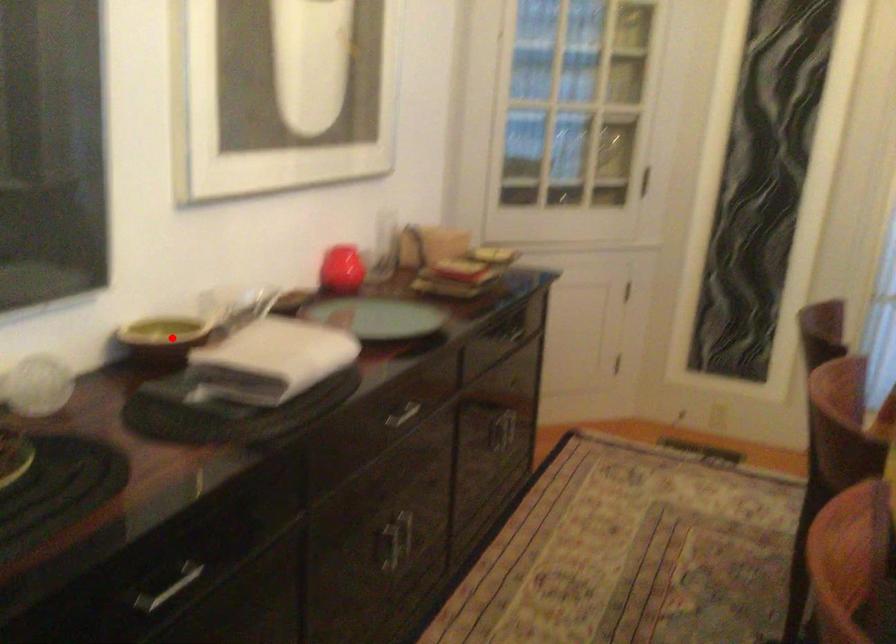
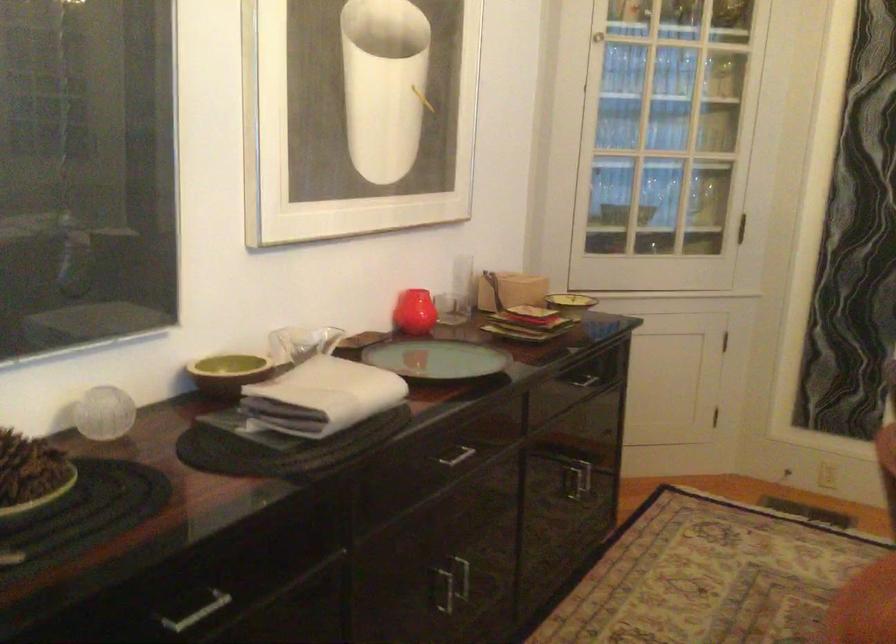
Where in the second image is the point corresponding to the highlighted location from the first image?

(228, 373)